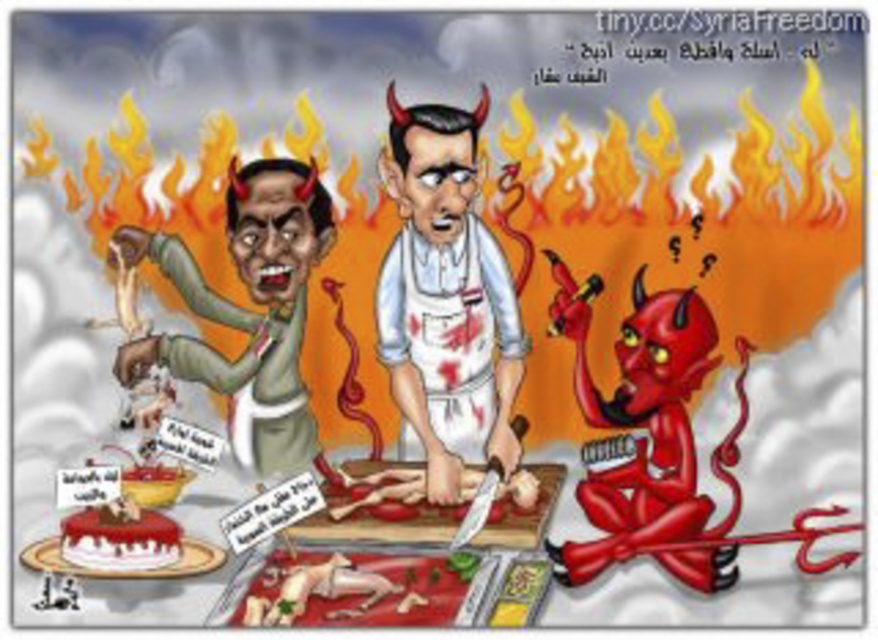
Question: Is blood-stained apron butcher at center in front of shiny red devil at center?

Choices:
 (A) yes
 (B) no

Answer: (B)

Question: Based on their relative distances, which object is nearer to the white frosted cake at lower left?

Choices:
 (A) green matte devil at left
 (B) blood-stained apron butcher at center
 (C) shiny red devil at center

Answer: (A)

Question: Is blood-stained apron butcher at center smaller than shiny red devil at center?

Choices:
 (A) no
 (B) yes

Answer: (A)

Question: Is blood-stained apron butcher at center bigger than green matte devil at left?

Choices:
 (A) yes
 (B) no

Answer: (A)

Question: Which is farther from the shiny red devil at center?

Choices:
 (A) blood-stained apron butcher at center
 (B) white frosted cake at lower left
 (C) green matte devil at left

Answer: (B)

Question: Which object appears farthest from the camera in this image?

Choices:
 (A) green matte devil at left
 (B) blood-stained apron butcher at center
 (C) shiny red devil at center

Answer: (A)